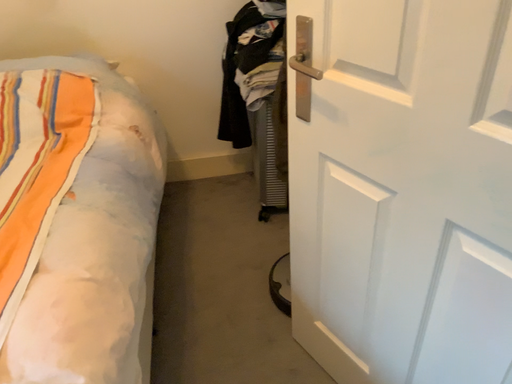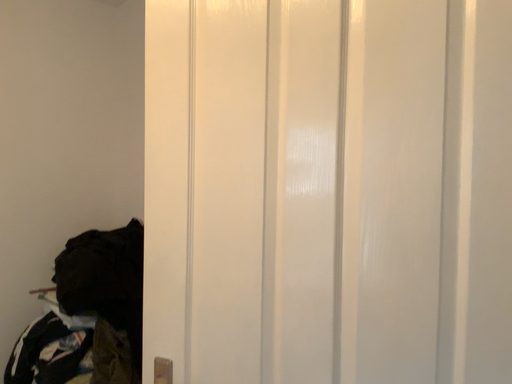
Question: Which way did the camera rotate in the video?

Choices:
 (A) rotated upward
 (B) rotated downward

Answer: (A)